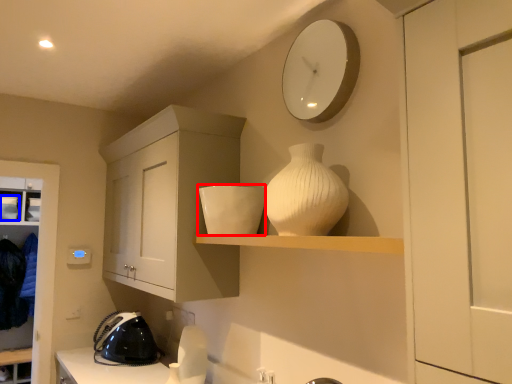
Question: Which object appears farthest to the camera in this image, appliance (highlighted by a red box) or appliance (highlighted by a blue box)?

Choices:
 (A) appliance
 (B) appliance

Answer: (B)